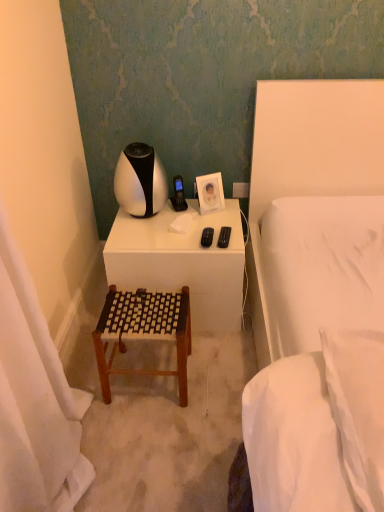
Find the location of a particular element. This screenshot has width=384, height=512. free point below brown woven stool at center (from a real-world perspective) is located at coordinates (148, 374).